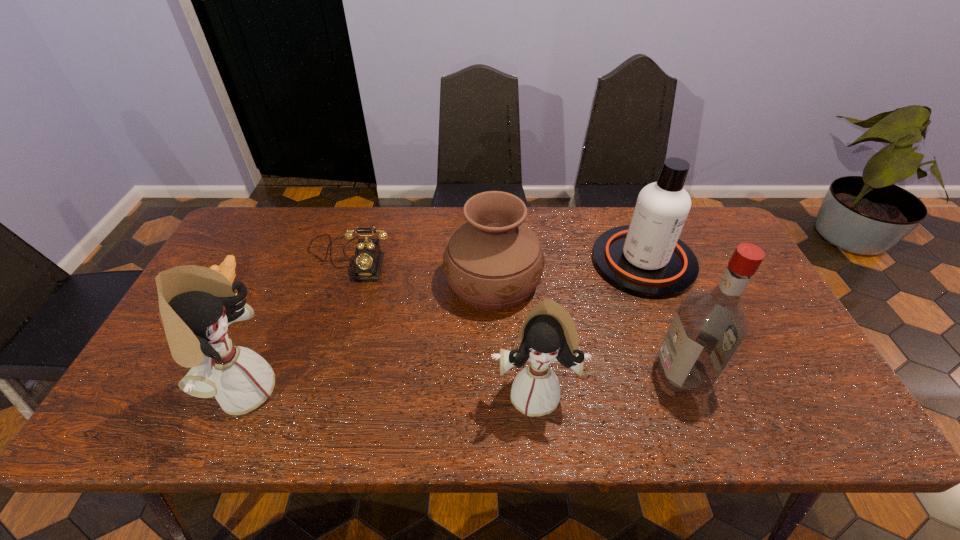
Find the location of `object that is at the left edge`. object that is at the left edge is located at coordinates (227, 268).

Find the location of a particular element. object that is at the right edge is located at coordinates (646, 259).

Find the location of a particular element. Image resolution: width=960 pixels, height=540 pixels. object situated at the far right corner is located at coordinates (646, 259).

Where is `vacant space at the far edge of the desktop`? This screenshot has height=540, width=960. vacant space at the far edge of the desktop is located at coordinates (374, 238).

In the image, there is a desktop. At what (x,y) coordinates should I click in order to perform the action: click on blank space at the near edge. Please return your answer as a coordinate pair (x, y). The height and width of the screenshot is (540, 960). Looking at the image, I should click on (424, 396).

In the image, there is a desktop. Where is `free space at the right edge`? This screenshot has height=540, width=960. free space at the right edge is located at coordinates (753, 347).

Identify the location of vacant area at the far right corner of the desktop. This screenshot has height=540, width=960. (695, 212).

You are a GUI agent. You are given a task and a screenshot of the screen. Output one action in this format:
    pyautogui.click(x=<x>, y=<y>)
    Task: Click on the free location at the near right corner
    This screenshot has height=540, width=960.
    Given the screenshot: What is the action you would take?
    pyautogui.click(x=793, y=393)

Identify the location of vacant area that lies between the urn and the duckling. This screenshot has height=540, width=960. (361, 281).

I want to click on vacant space that's between the sixth tallest object and the shortest object, so click(x=289, y=269).